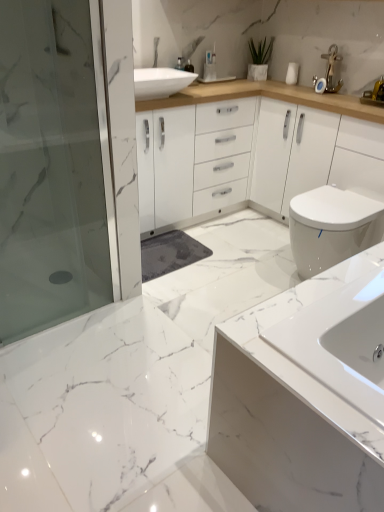
Image resolution: width=384 pixels, height=512 pixels. Find the location of `vacant point to the right of transparent glass shower door at left`. vacant point to the right of transparent glass shower door at left is located at coordinates (125, 326).